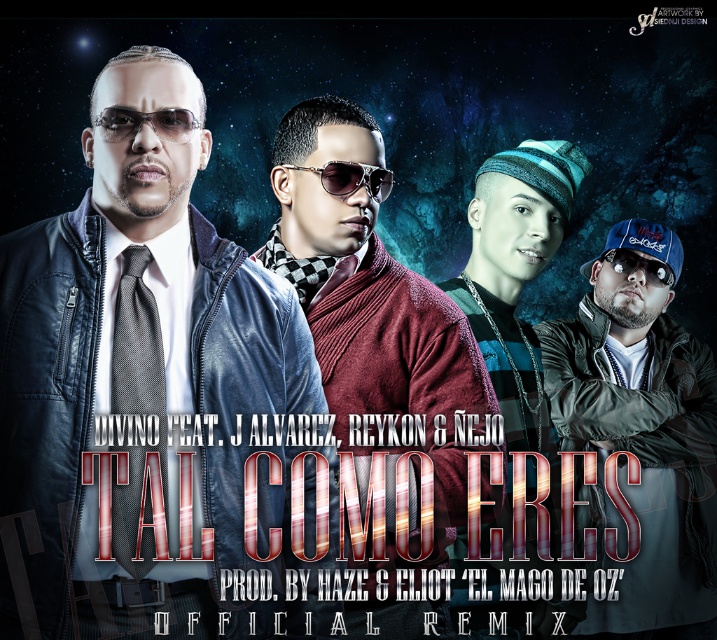
Question: In this image, where is leather jacket at center located relative to sunglassesmetallicgoggles at center?

Choices:
 (A) below
 (B) above

Answer: (A)

Question: Which object is the farthest from the maroon sweater at center?

Choices:
 (A) sunglasses at center
 (B) sunglassesmetallicgoggles at center
 (C) black plastic goggles at center

Answer: (C)

Question: Does leather jacket at center appear on the right side of green matte jacket at center?

Choices:
 (A) yes
 (B) no

Answer: (B)

Question: Which point is farther from the camera taking this photo?

Choices:
 (A) (x=543, y=333)
 (B) (x=381, y=301)
 (C) (x=384, y=186)
 (D) (x=141, y=64)

Answer: (A)

Question: Which object appears farthest from the camera in this image?

Choices:
 (A) sunglassesmetallicgoggles at center
 (B) blue knitted beanie at upper center
 (C) green matte jacket at center
 (D) maroon sweater at center

Answer: (C)

Question: Is the position of blue knitted beanie at upper center more distant than that of black plastic goggles at center?

Choices:
 (A) yes
 (B) no

Answer: (B)